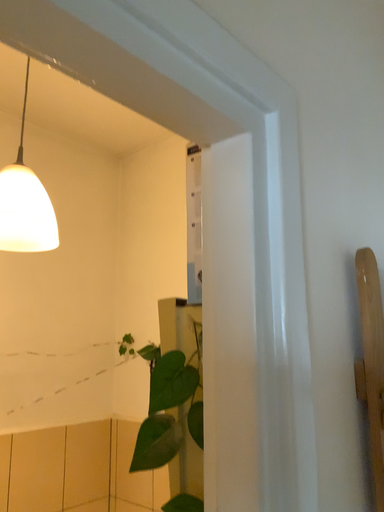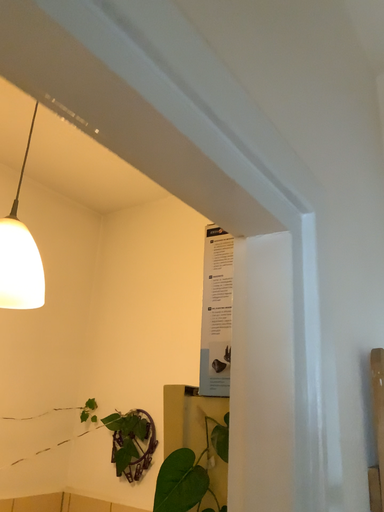
Question: How did the camera likely rotate when shooting the video?

Choices:
 (A) rotated upward
 (B) rotated downward

Answer: (A)